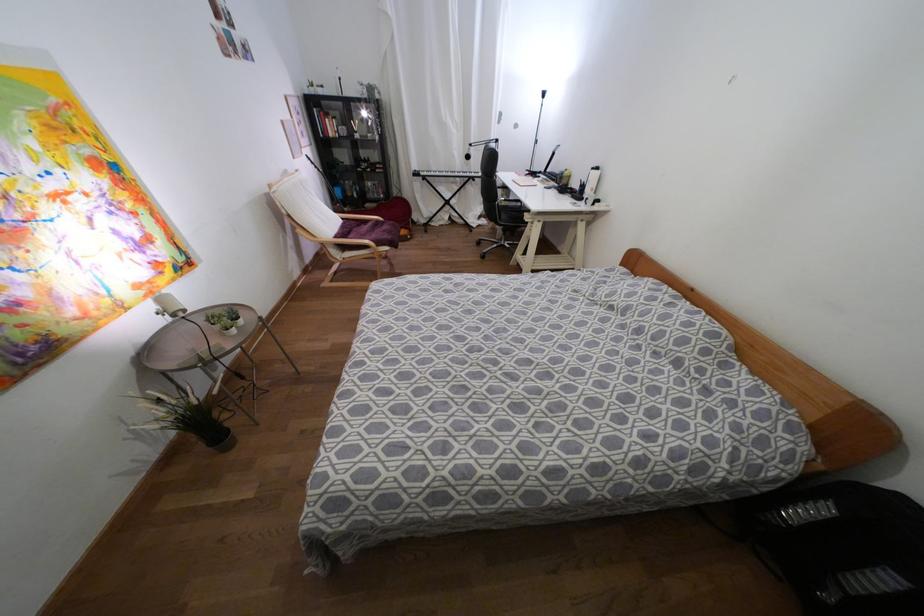
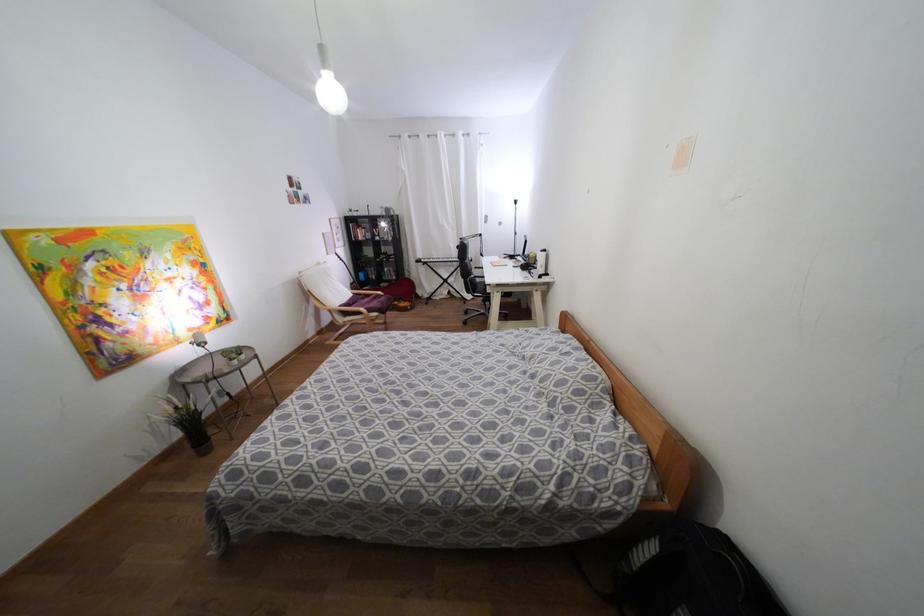
Locate, in the second image, the point that corresponds to (342,246) in the first image.

(344, 313)